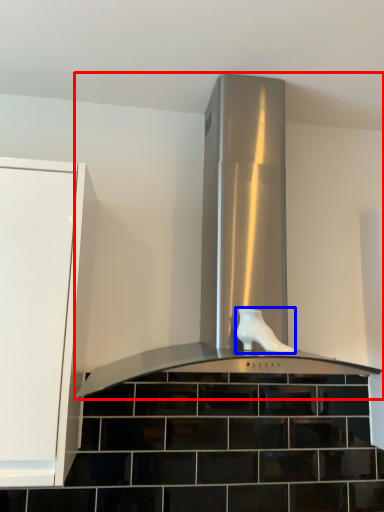
Question: Which point is closer to the camera, home appliance (highlighted by a red box) or footwear (highlighted by a blue box)?

Choices:
 (A) home appliance
 (B) footwear

Answer: (A)